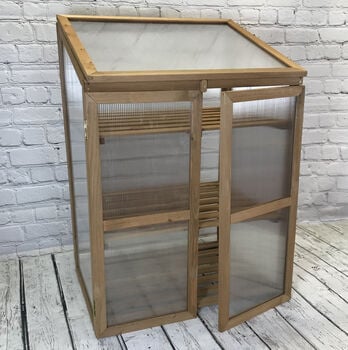
Where is `wood frame`? The height and width of the screenshot is (350, 348). wood frame is located at coordinates (284, 81), (87, 99), (241, 27).